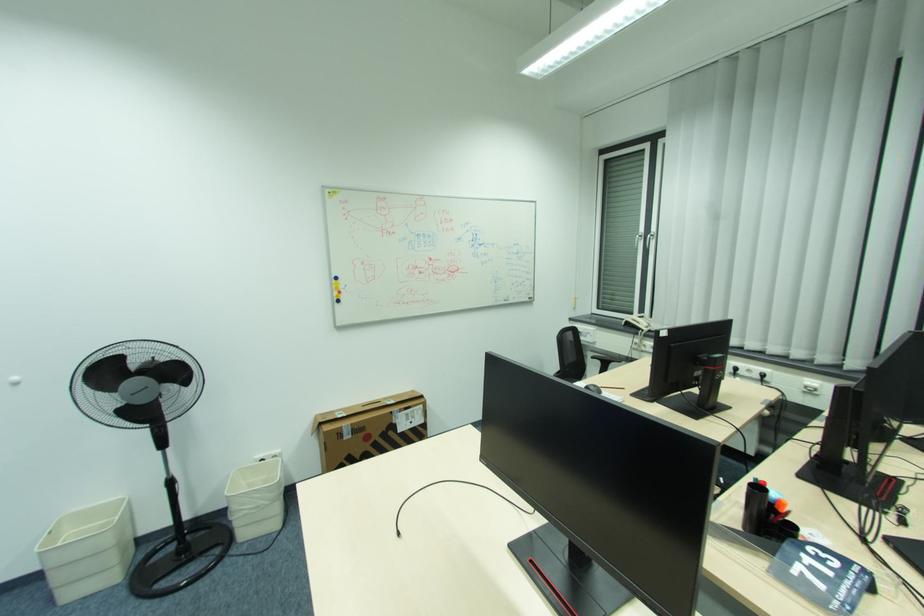
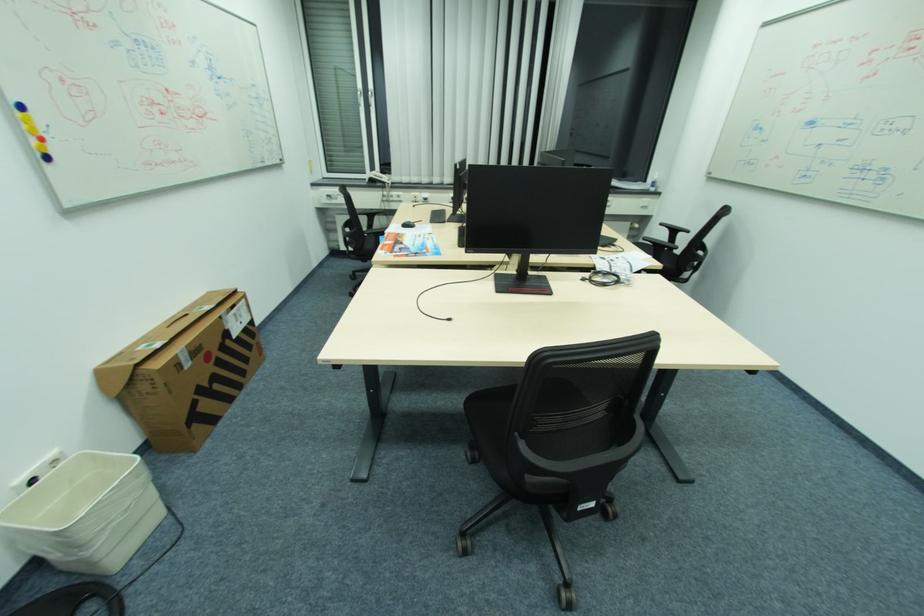
Find the pixel in the second image that matches (638,314) in the first image.

(370, 174)